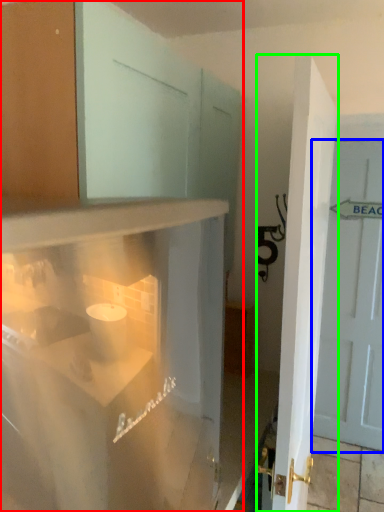
Question: Which object is positioned closest to cabinetry (highlighted by a red box)? Select from door (highlighted by a blue box) and door (highlighted by a green box).

Choices:
 (A) door
 (B) door

Answer: (B)